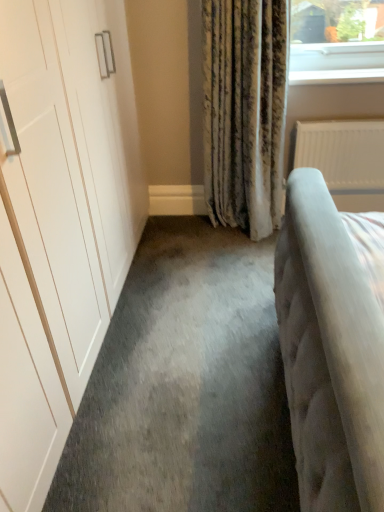
Question: Is white textured radiator at right not inside white glossy window sill at upper right?

Choices:
 (A) no
 (B) yes

Answer: (B)

Question: Does white textured radiator at right lie behind white glossy window sill at upper right?

Choices:
 (A) yes
 (B) no

Answer: (A)

Question: Is white textured radiator at right far from white glossy window sill at upper right?

Choices:
 (A) yes
 (B) no

Answer: (B)

Question: Does white textured radiator at right have a larger size compared to white glossy window sill at upper right?

Choices:
 (A) no
 (B) yes

Answer: (B)

Question: Can you confirm if white textured radiator at right is shorter than white glossy window sill at upper right?

Choices:
 (A) yes
 (B) no

Answer: (B)

Question: Is white textured radiator at right facing away from white glossy window sill at upper right?

Choices:
 (A) no
 (B) yes

Answer: (A)

Question: Is white glossy window sill at upper right in contact with white textured radiator at right?

Choices:
 (A) no
 (B) yes

Answer: (A)

Question: From the image's perspective, is white glossy window sill at upper right on white textured radiator at right?

Choices:
 (A) yes
 (B) no

Answer: (A)

Question: Is white glossy window sill at upper right positioned with its back to white textured radiator at right?

Choices:
 (A) no
 (B) yes

Answer: (A)

Question: From a real-world perspective, is white glossy window sill at upper right positioned over white textured radiator at right based on gravity?

Choices:
 (A) yes
 (B) no

Answer: (A)

Question: Is white glossy window sill at upper right wider than white textured radiator at right?

Choices:
 (A) no
 (B) yes

Answer: (B)

Question: Does white glossy window sill at upper right have a lesser width compared to white textured radiator at right?

Choices:
 (A) yes
 (B) no

Answer: (B)

Question: In the image, is white glossy window sill at upper right on the left side or the right side of white textured radiator at right?

Choices:
 (A) right
 (B) left

Answer: (B)